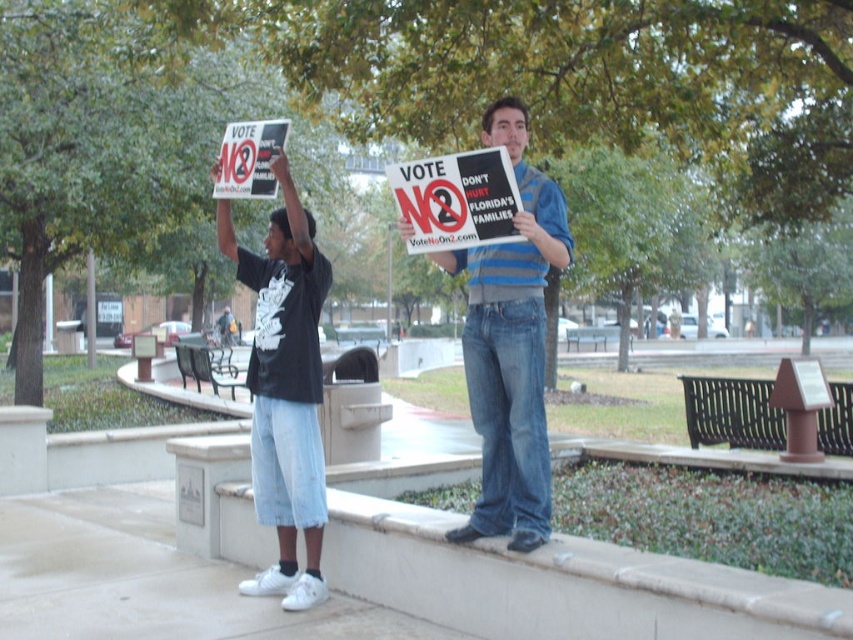
Does white smooth pavement at lower center appear over matte black t-shirt at left?

Actually, white smooth pavement at lower center is below matte black t-shirt at left.

Is white smooth pavement at lower center positioned behind matte black t-shirt at left?

That is False.

Where is `white smooth pavement at lower center`? The width and height of the screenshot is (853, 640). white smooth pavement at lower center is located at coordinates (148, 579).

The image size is (853, 640). Identify the location of white smooth pavement at lower center. (148, 579).

Is white smooth pavement at lower center further to camera compared to matte white sign at center?

Yes, it is.

The height and width of the screenshot is (640, 853). Identify the location of white smooth pavement at lower center. (148, 579).

Does matte white sign at center have a smaller size compared to white paper sign at upper center?

No.

Can you confirm if matte white sign at center is wider than white paper sign at upper center?

Yes, matte white sign at center is wider than white paper sign at upper center.

This screenshot has height=640, width=853. In order to click on matte white sign at center in this screenshot , I will do `click(456, 198)`.